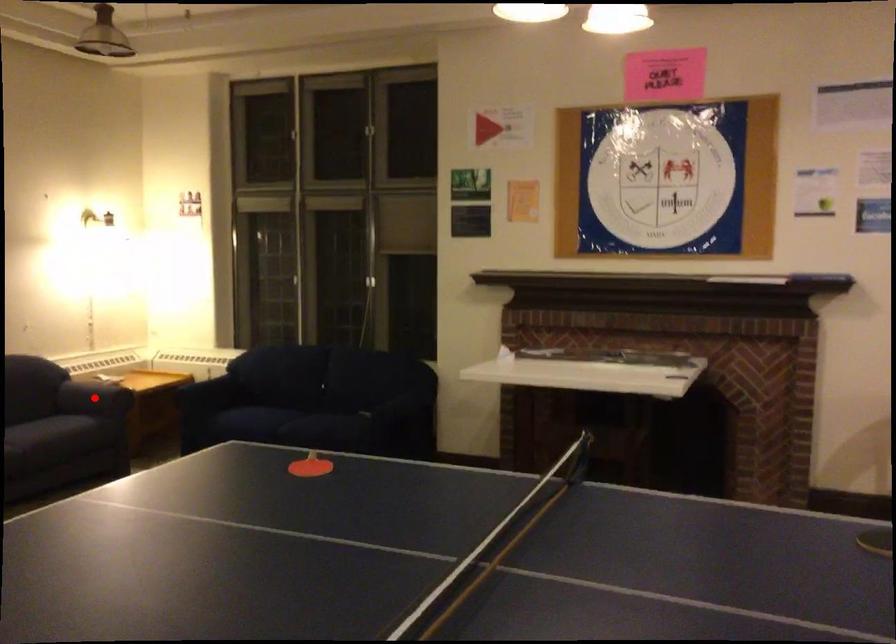
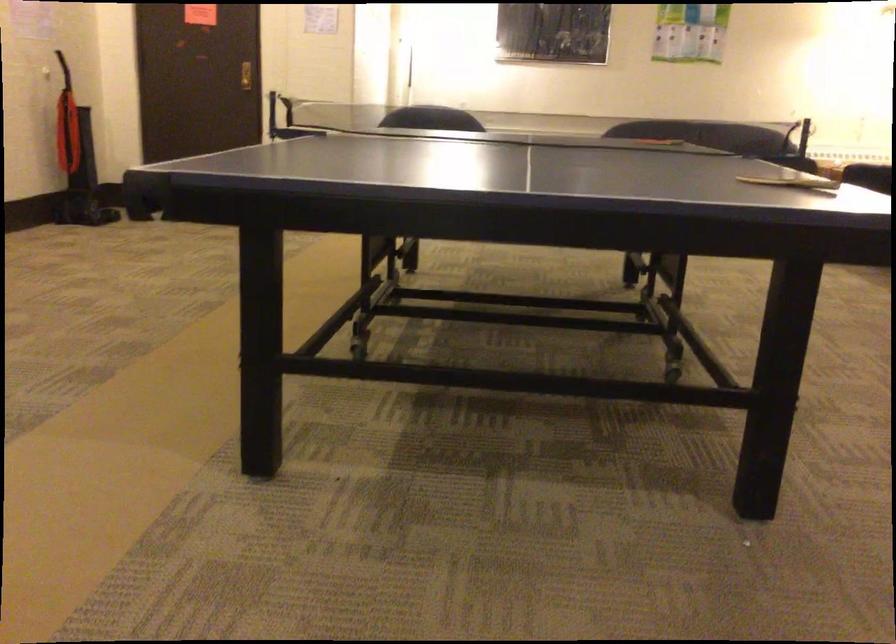
Question: I am providing you with two images of the same scene from different viewpoints. A red point is marked on the first image. Is the red point's position out of view in image 2?

Choices:
 (A) Yes
 (B) No

Answer: (A)